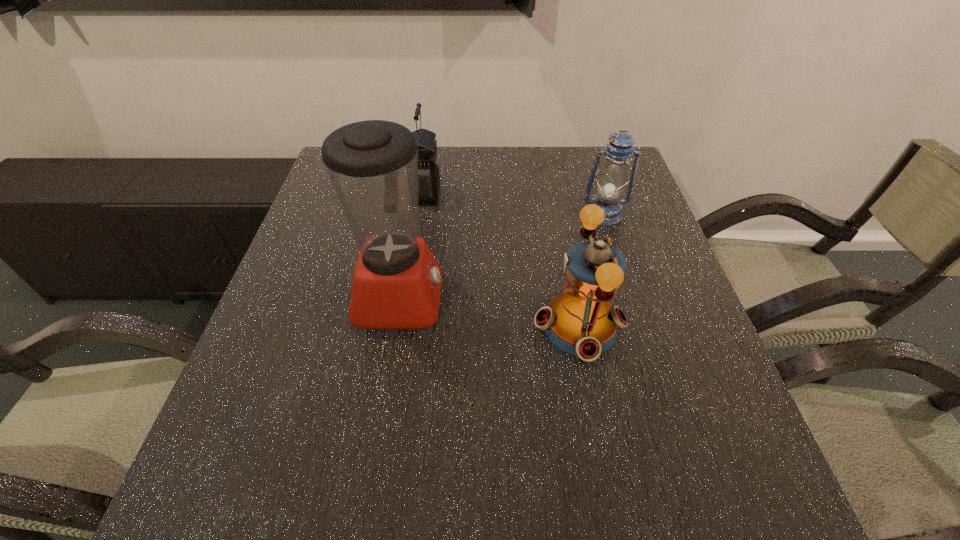
I want to click on blender, so click(x=373, y=165).

The height and width of the screenshot is (540, 960). I want to click on the leftmost lantern, so click(429, 171).

This screenshot has width=960, height=540. Identify the location of the nearest lantern. (581, 320).

This screenshot has width=960, height=540. Identify the location of vacant area located 0.130m on the front of the blender near the controls. (502, 299).

I want to click on free spot located 0.320m on the front-facing side of the leftmost lantern, so click(555, 196).

This screenshot has height=540, width=960. I want to click on vacant point located 0.240m on the front-facing side of the nearest lantern, so click(x=420, y=326).

Locate an element on the screen. free space located 0.250m on the front-facing side of the nearest lantern is located at coordinates (415, 326).

Identify the location of vacant space located on the front-facing side of the nearest lantern. (415, 326).

Identify the location of object positioned at the far edge. (429, 171).

Locate an element on the screen. free space at the far edge of the desktop is located at coordinates (555, 153).